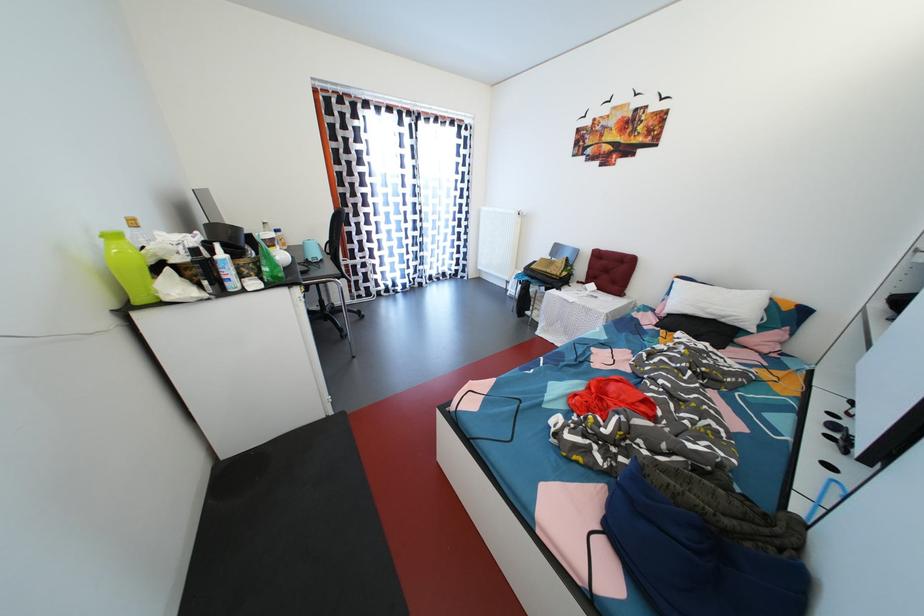
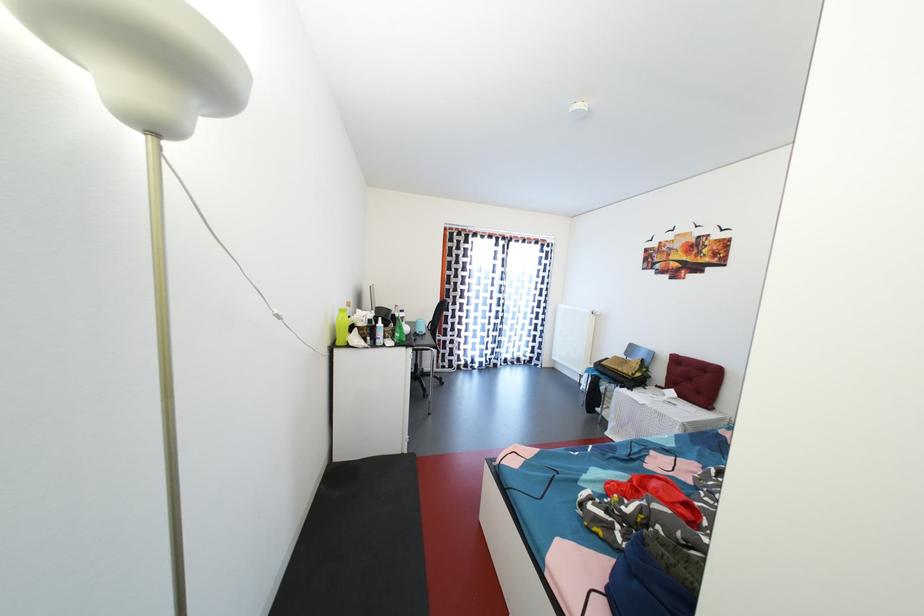
The point at [296,254] is marked in the first image. Where is the corresponding point in the second image?

(414, 329)